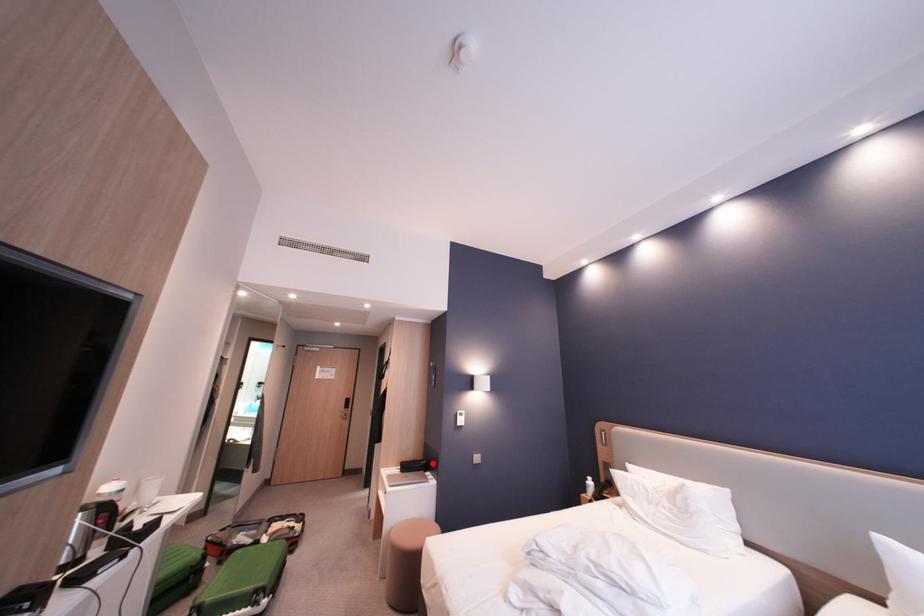
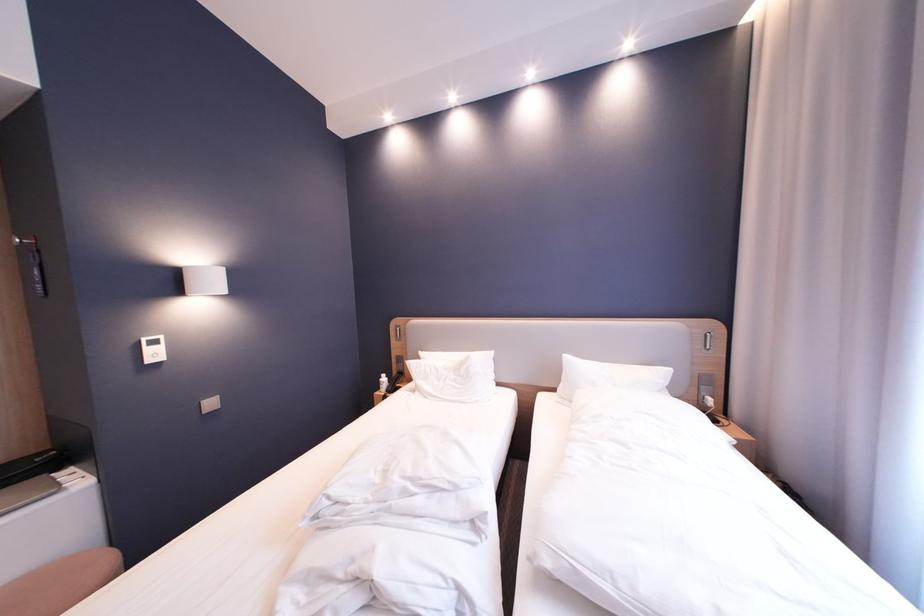
Find the pixel in the second image that matches the highlighted location in the first image.

(51, 460)